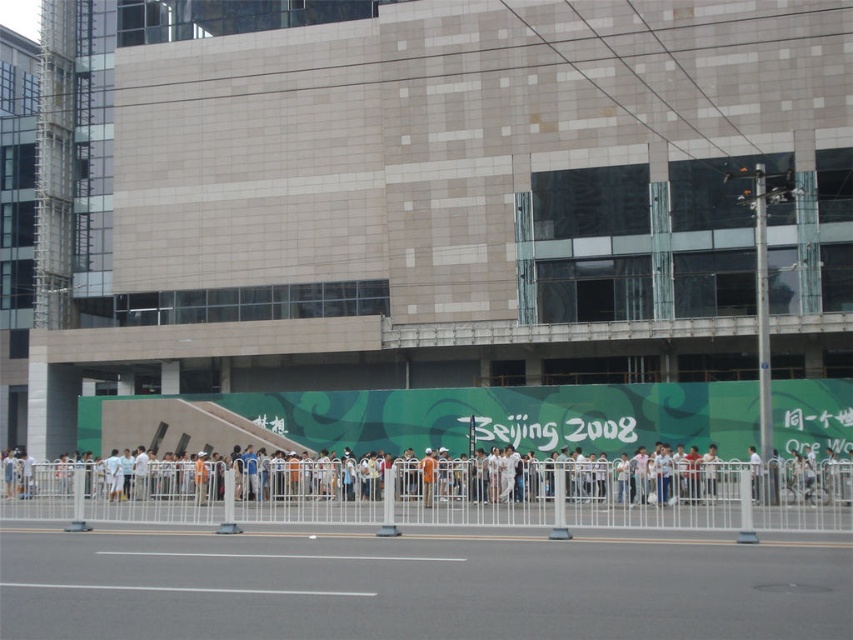
You are a pedestrian standing in front of the building and notice the white metal fence at center and the white glossy line at center. Which one is closer to the left side of the scene?

The white metal fence at center is to the left of the white glossy line at center, so it is closer to the left side of the scene.